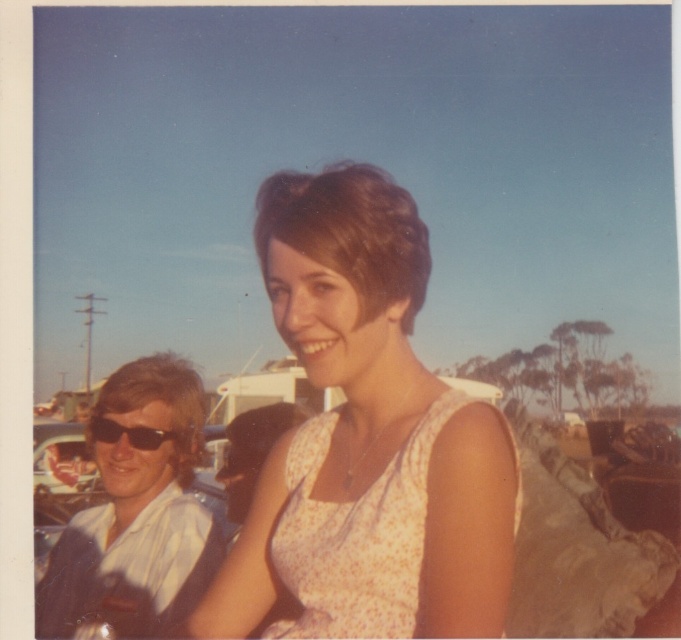
Question: In this image, where is white shirt at left located relative to floral cotton dress at center?

Choices:
 (A) above
 (B) below

Answer: (B)

Question: Where is white shirt at left located in relation to black plastic sunglasses at left in the image?

Choices:
 (A) above
 (B) below

Answer: (B)

Question: Which of the following is the closest to the observer?

Choices:
 (A) (140, 528)
 (B) (362, 253)
 (C) (330, 561)

Answer: (C)

Question: Does white shirt at left appear on the left side of floral cotton dress at center?

Choices:
 (A) yes
 (B) no

Answer: (A)

Question: Which point is closer to the camera?

Choices:
 (A) black plastic sunglasses at left
 (B) floral cotton dress at center

Answer: (B)

Question: Which point is farther from the camera taking this photo?

Choices:
 (A) [348, 522]
 (B) [93, 444]
 (C) [373, 193]

Answer: (B)